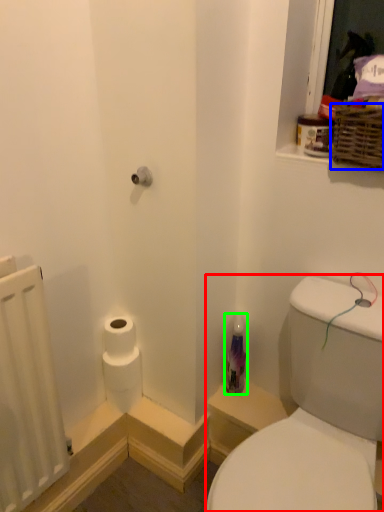
Question: Based on their relative distances, which object is farther from sink (highlighted by a red box)? Choose from basket (highlighted by a blue box) and toiletry (highlighted by a green box).

Choices:
 (A) basket
 (B) toiletry

Answer: (A)